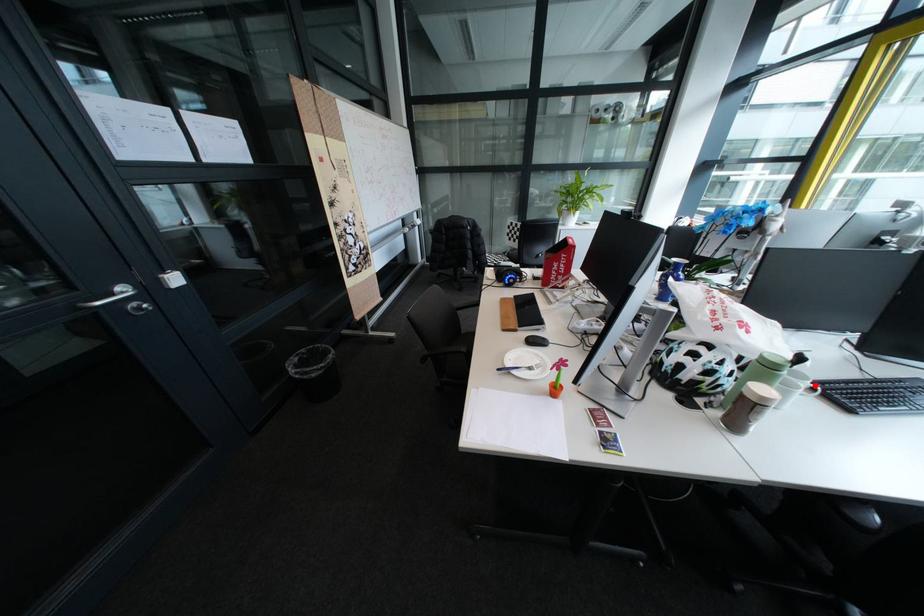
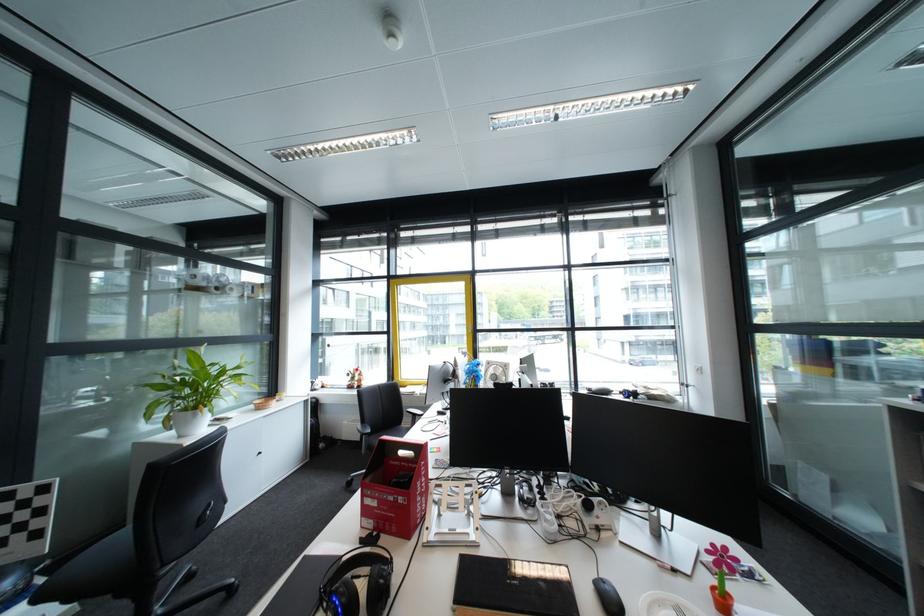
Question: I am providing you with two images of the same scene from different viewpoints. A red point is marked on the first image. At the location where the point appears in image 1, is it still visible in image 2?

Choices:
 (A) Yes
 (B) No

Answer: (B)